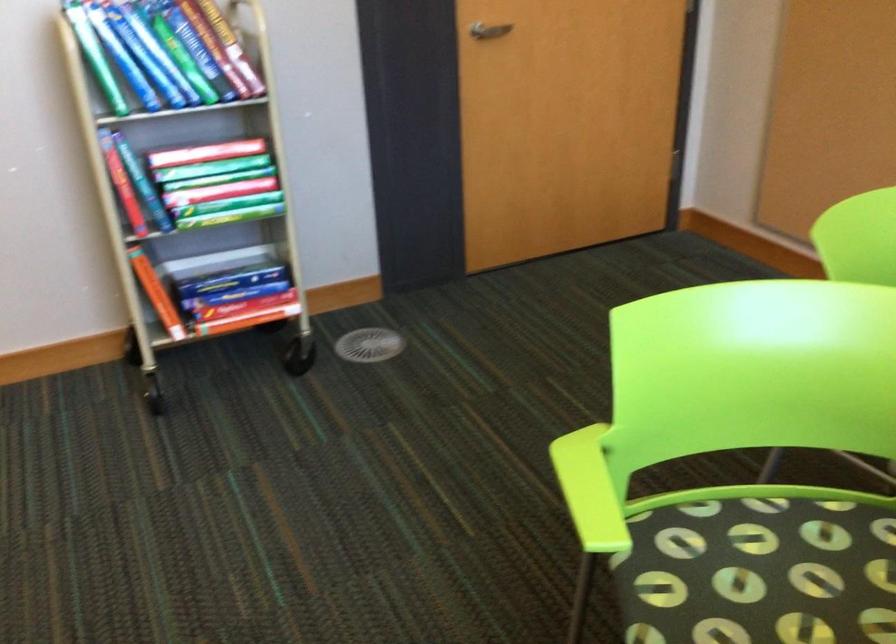
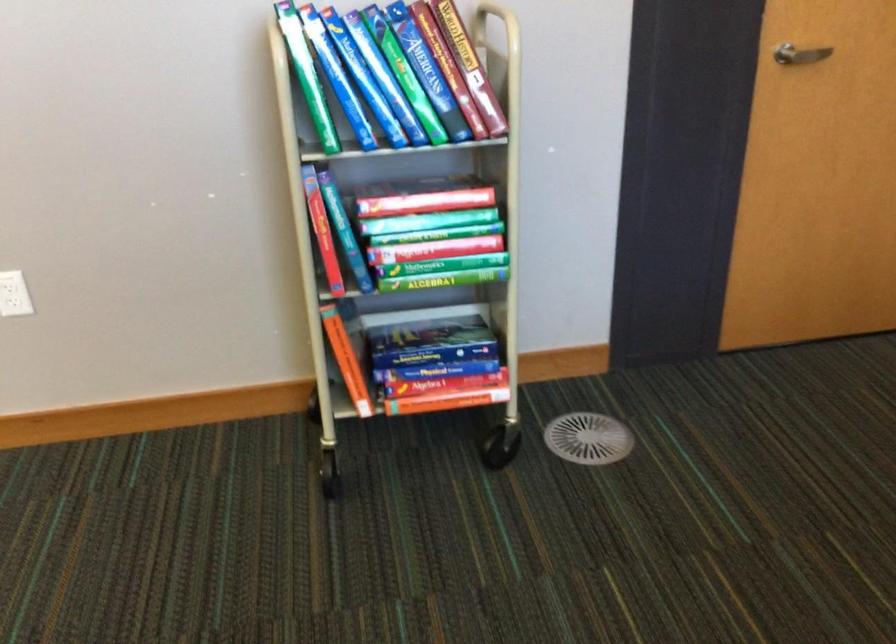
Question: The first image is from the beginning of the video and the second image is from the end. How did the camera likely rotate when shooting the video?

Choices:
 (A) Left
 (B) Right
 (C) Up
 (D) Down

Answer: (A)